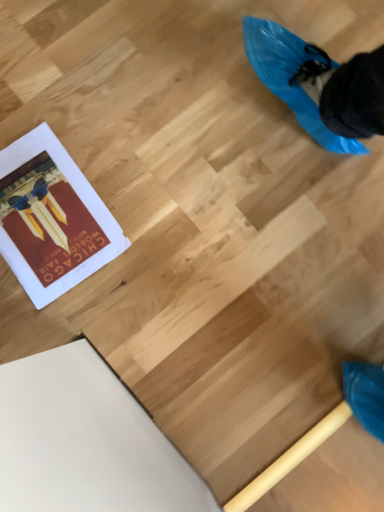
Where is `free space underneath matte paper poster at lower left (from a real-world perspective)`? free space underneath matte paper poster at lower left (from a real-world perspective) is located at coordinates (47, 216).